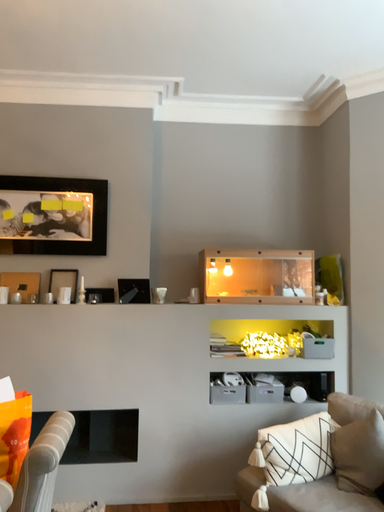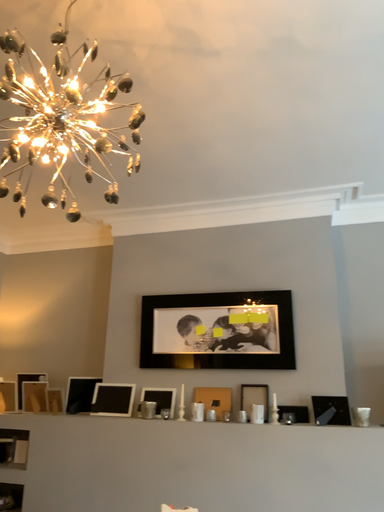
Question: Which way did the camera rotate in the video?

Choices:
 (A) rotated downward
 (B) rotated upward

Answer: (B)